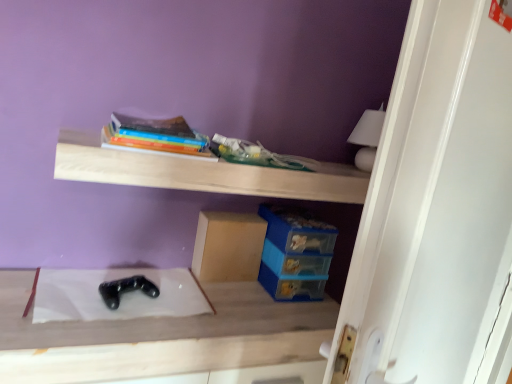
Question: Can you confirm if white glossy door at upper right is taller than hardcover book at upper center?

Choices:
 (A) yes
 (B) no

Answer: (A)

Question: Can you confirm if white glossy door at upper right is positioned to the right of hardcover book at upper center?

Choices:
 (A) yes
 (B) no

Answer: (A)

Question: Is white glossy door at upper right not near hardcover book at upper center?

Choices:
 (A) no
 (B) yes

Answer: (A)

Question: Is white glossy door at upper right wider than hardcover book at upper center?

Choices:
 (A) yes
 (B) no

Answer: (B)

Question: Is white glossy door at upper right not within hardcover book at upper center?

Choices:
 (A) no
 (B) yes

Answer: (B)

Question: Can you confirm if white glossy door at upper right is thinner than hardcover book at upper center?

Choices:
 (A) no
 (B) yes

Answer: (B)

Question: From a real-world perspective, is hardcover book at upper center on top of black matte game controller at center?

Choices:
 (A) yes
 (B) no

Answer: (A)

Question: Is hardcover book at upper center wider than black matte game controller at center?

Choices:
 (A) yes
 (B) no

Answer: (B)

Question: Is hardcover book at upper center taller than black matte game controller at center?

Choices:
 (A) yes
 (B) no

Answer: (B)

Question: Can you confirm if hardcover book at upper center is smaller than black matte game controller at center?

Choices:
 (A) yes
 (B) no

Answer: (A)

Question: From a real-world perspective, does hardcover book at upper center sit lower than black matte game controller at center?

Choices:
 (A) yes
 (B) no

Answer: (B)

Question: Is hardcover book at upper center looking in the opposite direction of black matte game controller at center?

Choices:
 (A) no
 (B) yes

Answer: (A)

Question: Is wooden shelf at upper center shorter than black matte game controller at center?

Choices:
 (A) no
 (B) yes

Answer: (B)